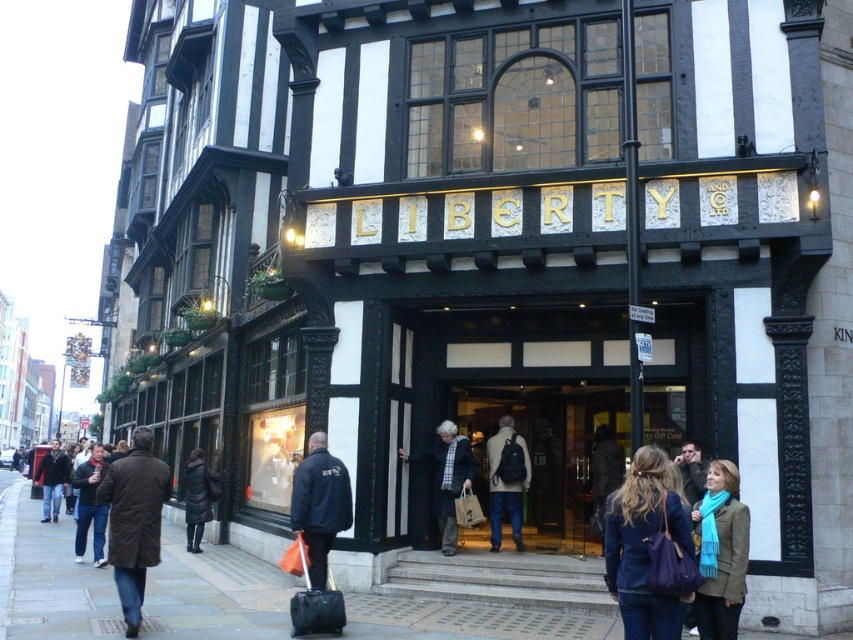
Question: Is matte blue jacket at lower right bigger than blue scarf at center?

Choices:
 (A) yes
 (B) no

Answer: (A)

Question: Which point is closer to the camera?

Choices:
 (A) (693, 449)
 (B) (715, 488)
 (C) (445, 484)
 (D) (515, 428)

Answer: (B)

Question: Which of the following is the closest to the observer?

Choices:
 (A) (415, 602)
 (B) (508, 474)
 (C) (461, 404)
 (D) (694, 474)

Answer: (D)

Question: Observing the image, what is the correct spatial positioning of matte black door at center in reference to blue scarf at lower right?

Choices:
 (A) above
 (B) below

Answer: (A)

Question: Considering the real-world distances, which object is farthest from the brown leather coat at lower left?

Choices:
 (A) dark brown leather jacket at lower left
 (B) matte black backpack at center

Answer: (A)

Question: From the image, what is the correct spatial relationship of smooth concrete pavement at center in relation to black down jacket at lower left?

Choices:
 (A) below
 (B) above

Answer: (A)